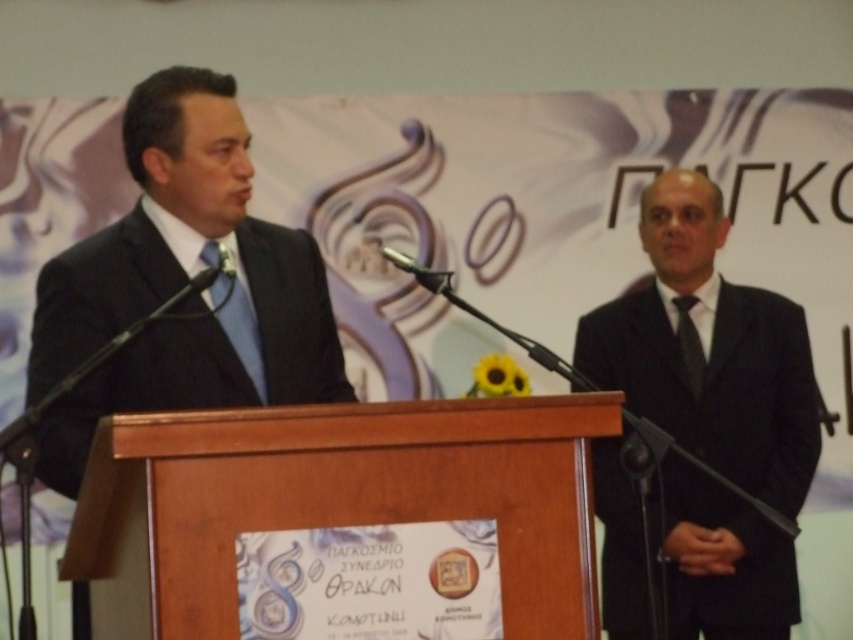
Question: Is the position of black textured tie at right less distant than that of metallic at left?

Choices:
 (A) yes
 (B) no

Answer: (B)

Question: Which object is the farthest from the black textured suit at left?

Choices:
 (A) dark gray suit at center
 (B) black textured tie at right
 (C) metallic at left

Answer: (B)

Question: Which point is farther to the camera?

Choices:
 (A) (393, 250)
 (B) (695, 368)

Answer: (B)

Question: Does blue silk tie at center have a smaller size compared to black textured tie at right?

Choices:
 (A) no
 (B) yes

Answer: (A)

Question: Which point is closer to the camera?

Choices:
 (A) (689, 298)
 (B) (236, 312)
 (C) (668, 225)
 (D) (236, 180)

Answer: (D)

Question: Does dark gray suit at center appear over black textured suit at left?

Choices:
 (A) no
 (B) yes

Answer: (A)